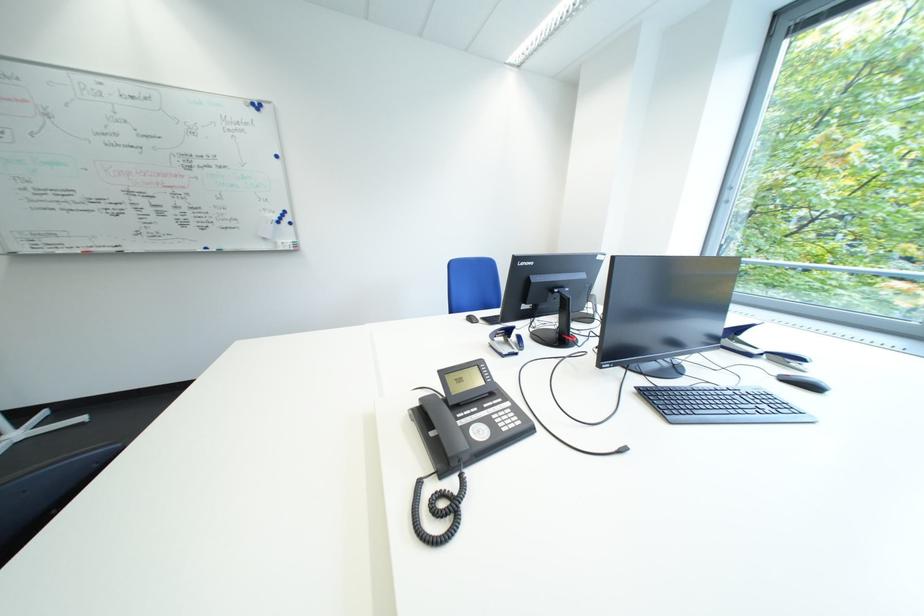
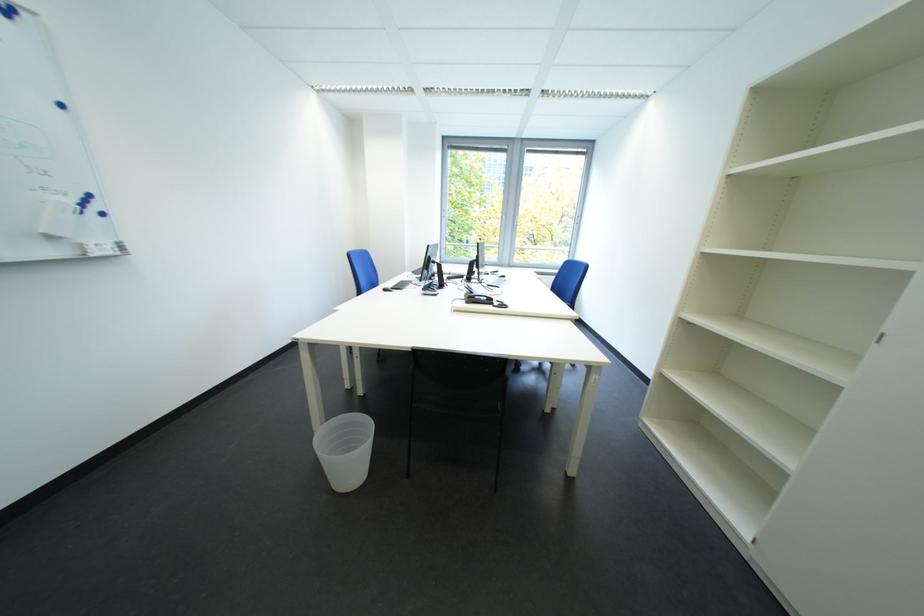
The point at (294, 251) is marked in the first image. Where is the corresponding point in the second image?

(108, 256)